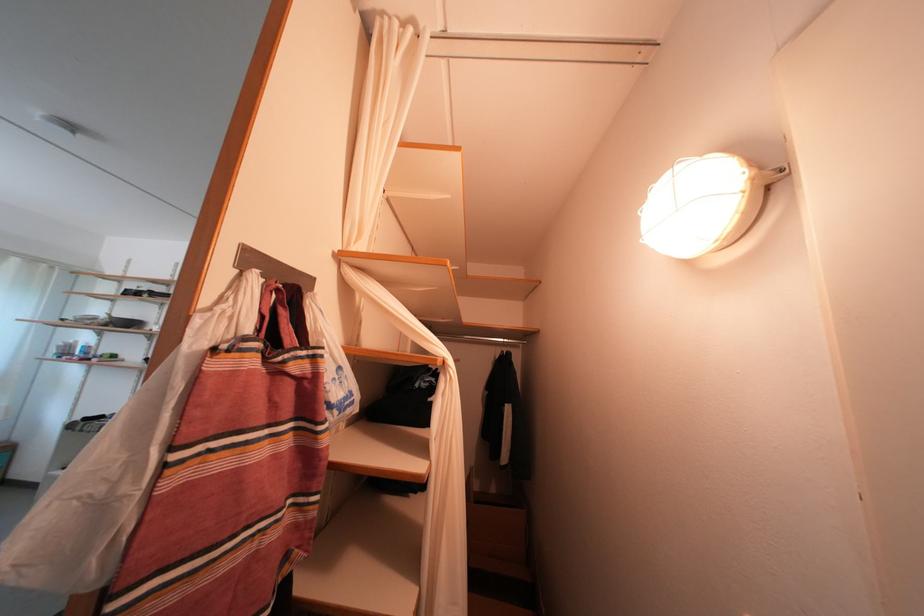
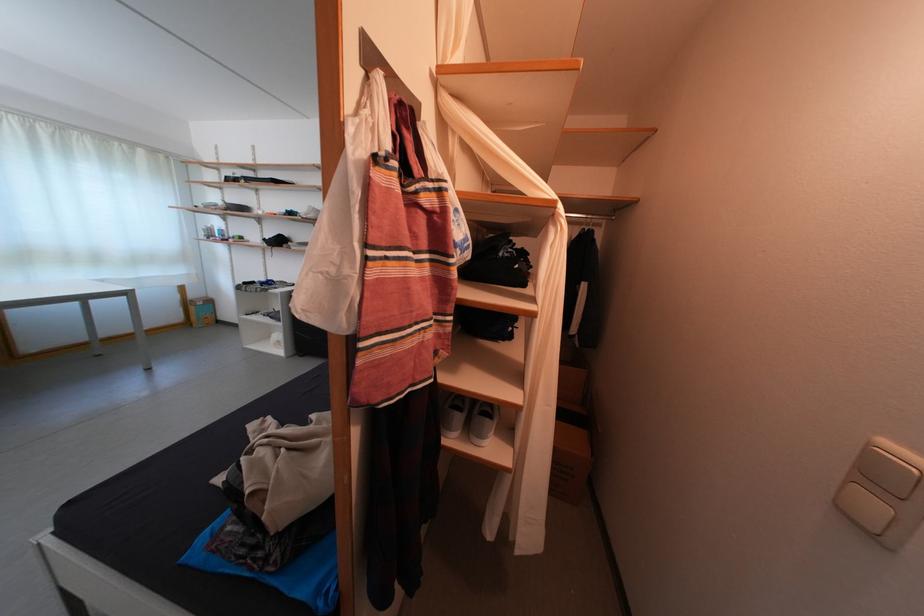
Question: In a continuous first-person perspective shot, in which direction is the camera moving?

Choices:
 (A) Left
 (B) Right
 (C) Forward
 (D) Backward

Answer: (A)